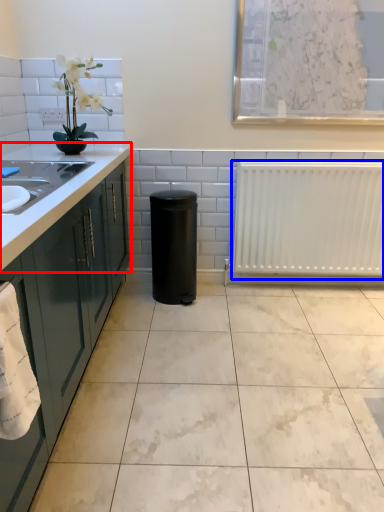
Question: Among these objects, which one is nearest to the camera, countertop (highlighted by a red box) or radiator (highlighted by a blue box)?

Choices:
 (A) countertop
 (B) radiator

Answer: (A)